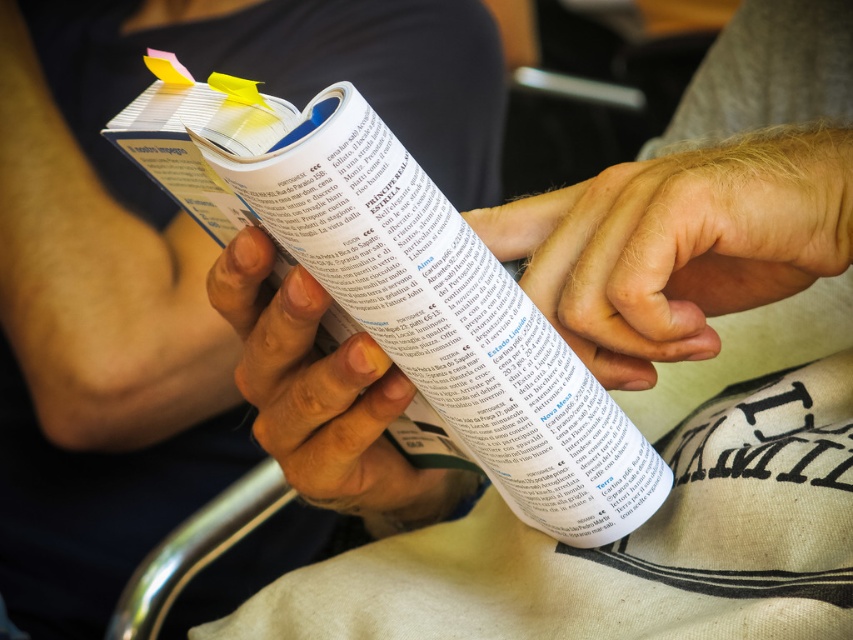
You are trying to locate the matte paper book at center in the image. According to the coordinates provided, where exactly is it positioned?

The matte paper book at center is located at point coordinates of 0.142 on the x axis and 0.306 on the y axis.

You are a graphic designer working on a layout for a new book. You need to place a decorative border around the matte paper book at center. Given that the border must be placed exactly at the point specified by point (260,90), can you confirm if this point is part of the matte paper book at center?

The matte paper book at center is represented by point (260,90), so yes, the border should be placed at this point as it corresponds to the book.

You are a chef preparing a recipe and need to check the ingredients list in the matte paper book at center. Since your hands are holding the book, can you see the ingredients clearly without moving your light skin tone flesh at center?

The matte paper book at center is to the left of light skin tone flesh at center, so the chef can see the ingredients clearly without moving their hand because the book is positioned to the side of the hand.